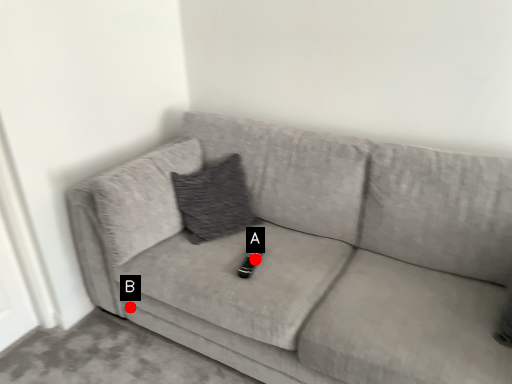
Question: Two points are circled on the image, labeled by A and B beside each circle. Which point is farther to the camera?

Choices:
 (A) A is further
 (B) B is further

Answer: (B)